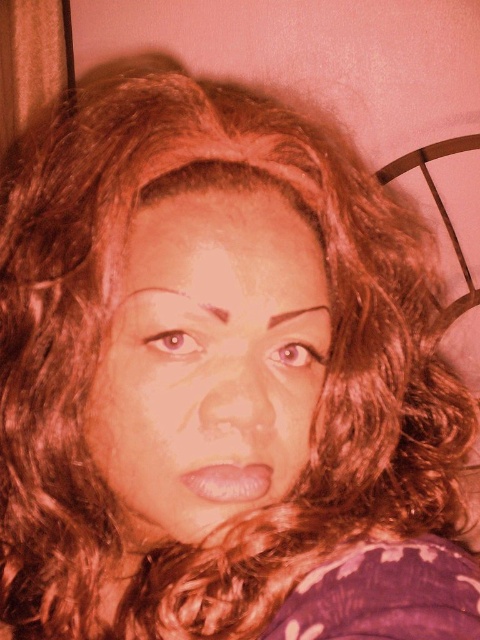
You are an AI analyzing a portrait photo. The photo has a subject with curly hair and a bed frame in the background. You need to determine the exact coordinates of the brown matte eye at upper left. What are its coordinates?

The brown matte eye at upper left is located at coordinates point (173,342).

You are a photographer adjusting the lighting in a studio. You notice a point at coordinates (173, 342) in the image. Based on the scene description, what object does this point likely correspond to?

The point at coordinates (173, 342) corresponds to the brown matte eye at upper left.